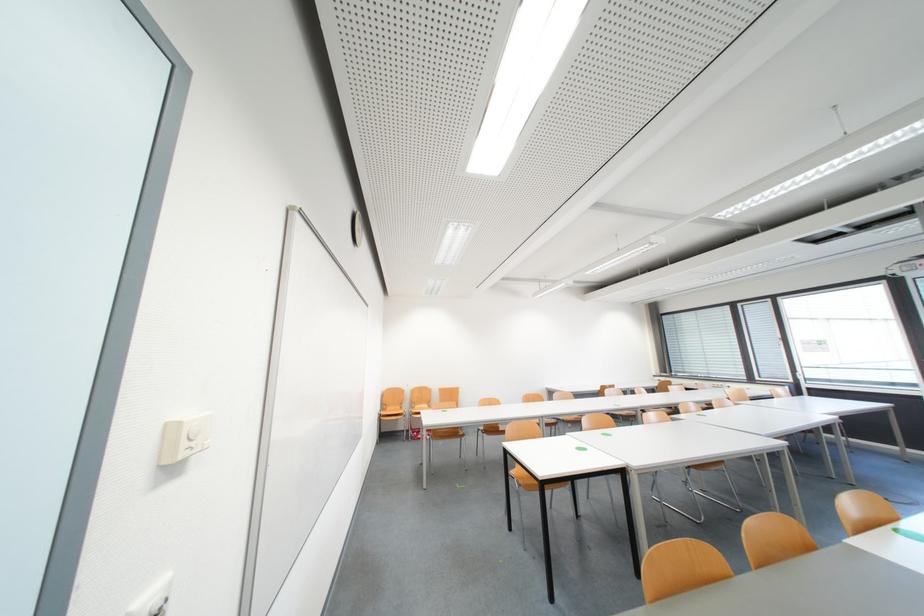
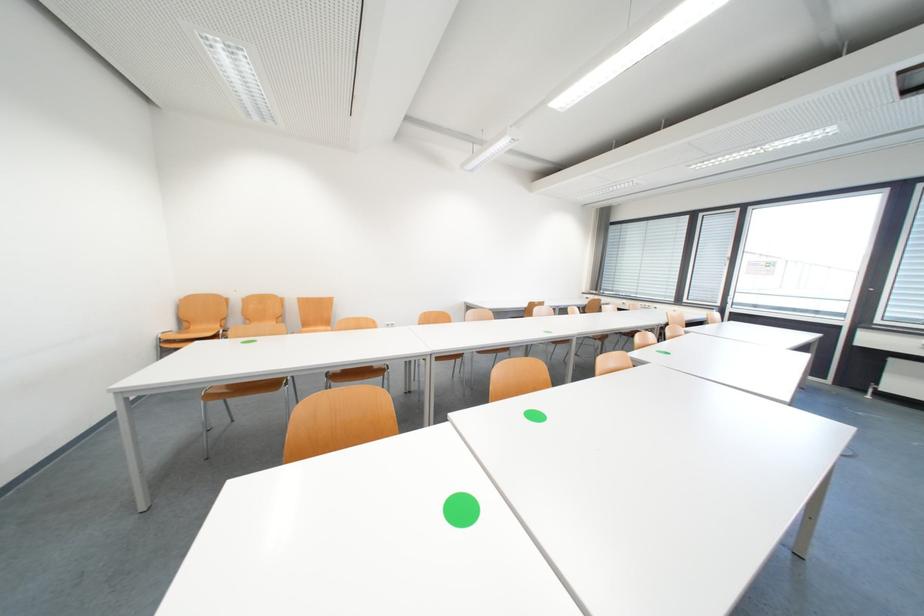
In a continuous first-person perspective shot, in which direction is the camera moving?

The movement direction of the cameraman is right, forward.